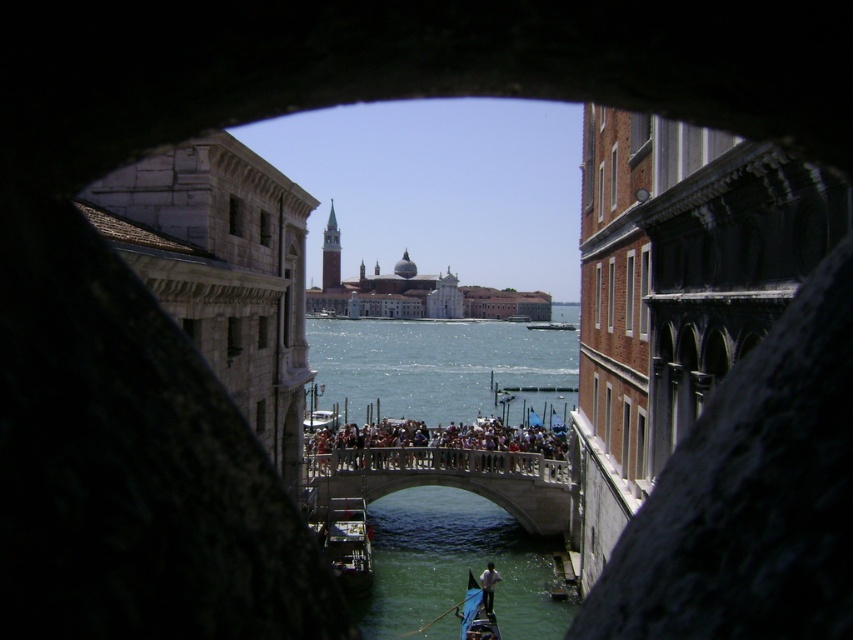
Does point (350, 502) lie in front of point (488, 609)?

No.

Between point (352, 588) and point (495, 620), which one is positioned behind?

The point (352, 588) is more distant.

Image resolution: width=853 pixels, height=640 pixels. Describe the element at coordinates (347, 545) in the screenshot. I see `metallic polished boat at center` at that location.

I want to click on metallic polished boat at center, so click(347, 545).

The height and width of the screenshot is (640, 853). I want to click on stone bridge at center, so click(450, 477).

Who is positioned more to the right, stone bridge at center or metallic polished boat at center?

From the viewer's perspective, stone bridge at center appears more on the right side.

Between point (384, 460) and point (363, 552), which one is positioned in front?

Point (363, 552) is in front.

The image size is (853, 640). I want to click on stone bridge at center, so click(x=450, y=477).

Is stone bridge at center to the right of white fabric shirt at lower center from the viewer's perspective?

In fact, stone bridge at center is to the left of white fabric shirt at lower center.

Who is lower down, stone bridge at center or white fabric shirt at lower center?

white fabric shirt at lower center is lower down.

Identify the location of stone bridge at center. This screenshot has width=853, height=640. (450, 477).